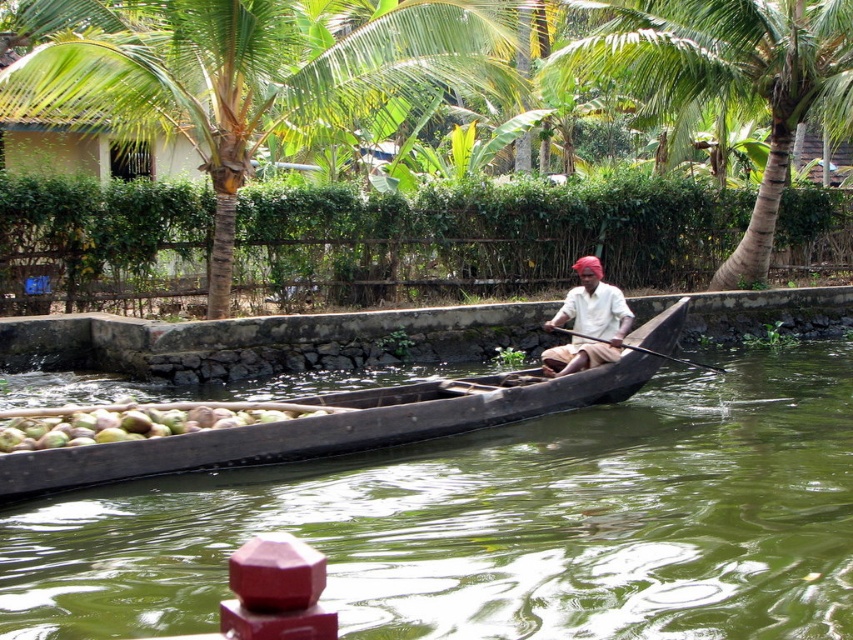
You are standing on the bank of the canal and see the green rough coconut at center and the light brown wooden boat at center. Which object is closer to your right side?

The light brown wooden boat at center is closer to your right side because the green rough coconut at center is positioned on the left side of it.

You are a tourist standing on the dock and want to take a photo of the green leafy coconut tree at center and the black wood paddle at center. Which object will appear larger in your photo?

The green leafy coconut tree at center will appear larger in the photo because it is much taller than the black wood paddle at center.